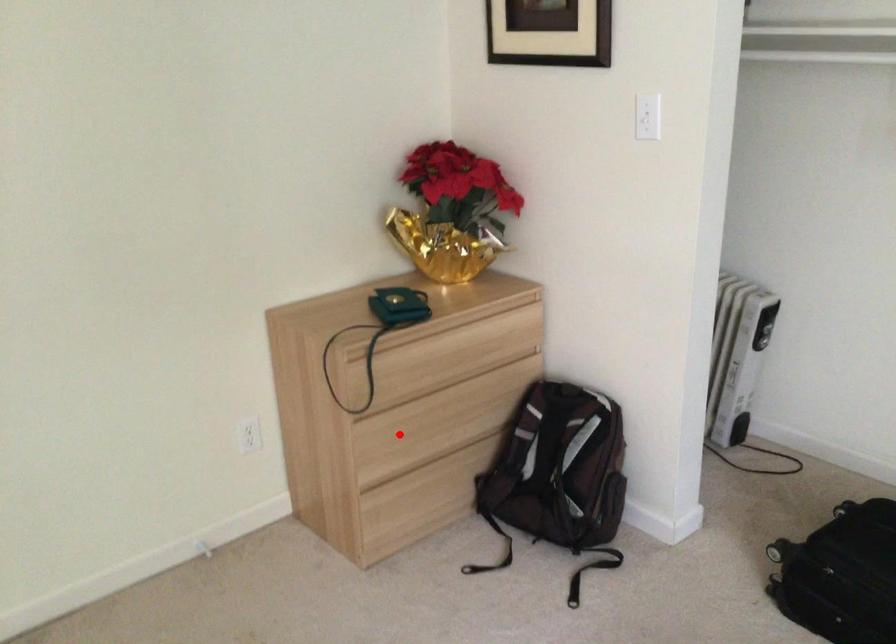
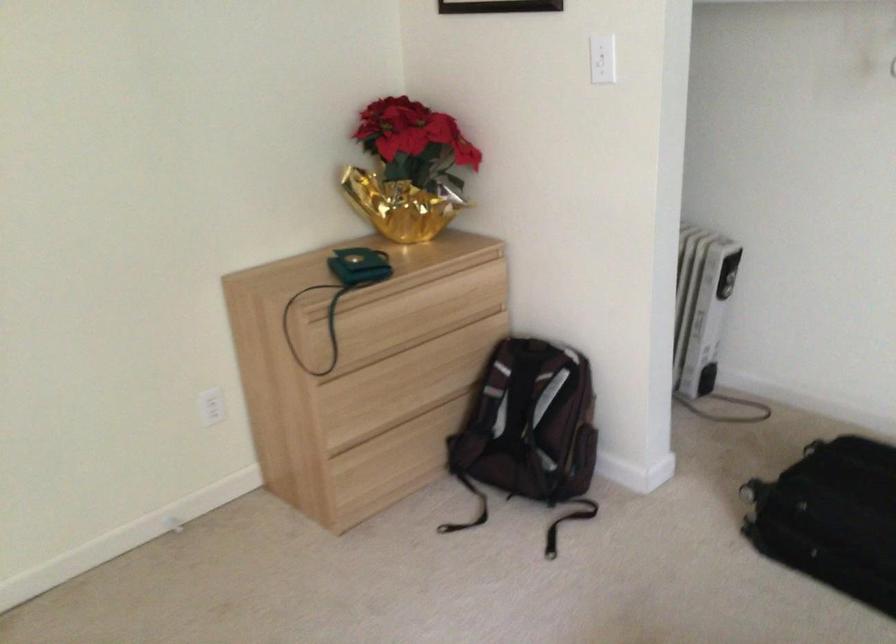
Question: I am providing you with two images of the same scene from different viewpoints. A red point is marked on the first image. At the location where the point appears in image 1, is it still visible in image 2?

Choices:
 (A) Yes
 (B) No

Answer: (A)